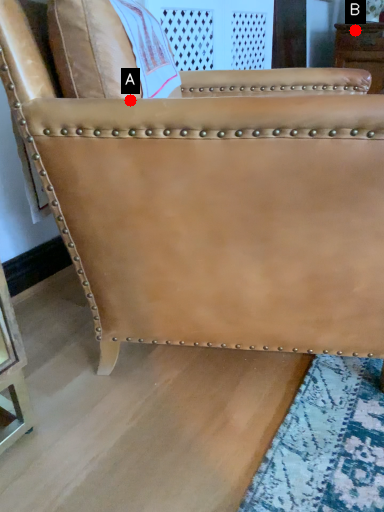
Question: Two points are circled on the image, labeled by A and B beside each circle. Which of the following is the closest to the observer?

Choices:
 (A) A is closer
 (B) B is closer

Answer: (A)